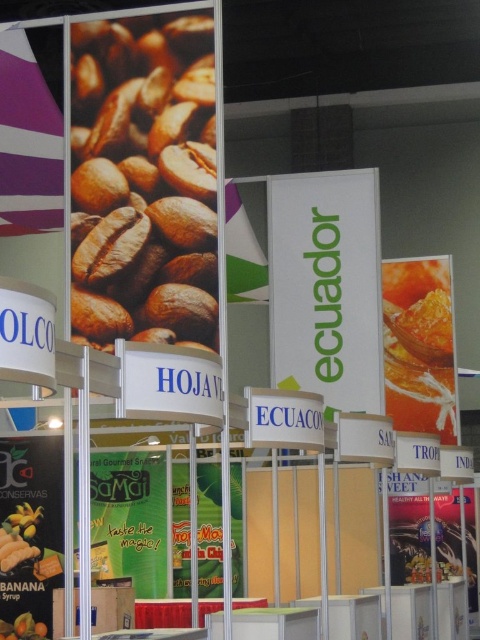
Can you confirm if shiny orange honeycomb at right is taller than yellow matte bananas at lower left?

Indeed, shiny orange honeycomb at right has a greater height compared to yellow matte bananas at lower left.

Between shiny orange honeycomb at right and yellow matte bananas at lower left, which one appears on the left side from the viewer's perspective?

yellow matte bananas at lower left

Where is `shiny orange honeycomb at right`? The height and width of the screenshot is (640, 480). shiny orange honeycomb at right is located at coordinates (420, 346).

Does brown matte coffee beans at upper left have a greater height compared to yellow matte banana syrup at lower left?

Correct, brown matte coffee beans at upper left is much taller as yellow matte banana syrup at lower left.

Measure the distance between brown matte coffee beans at upper left and camera.

brown matte coffee beans at upper left and camera are 12.18 meters apart.

Is point (145, 260) behind point (14, 550)?

Yes, point (145, 260) is farther from viewer.

Image resolution: width=480 pixels, height=640 pixels. Find the location of `brown matte coffee beans at upper left`. brown matte coffee beans at upper left is located at coordinates (144, 180).

Which of these two, yellow matte banana syrup at lower left or yellow matte bananas at lower left, stands shorter?

With less height is yellow matte bananas at lower left.

Between yellow matte banana syrup at lower left and yellow matte bananas at lower left, which one is positioned lower?

yellow matte bananas at lower left

Which is behind, point (34, 532) or point (0, 630)?

The point (34, 532) is behind.

This screenshot has width=480, height=640. Find the location of `yellow matte banana syrup at lower left`. yellow matte banana syrup at lower left is located at coordinates (19, 538).